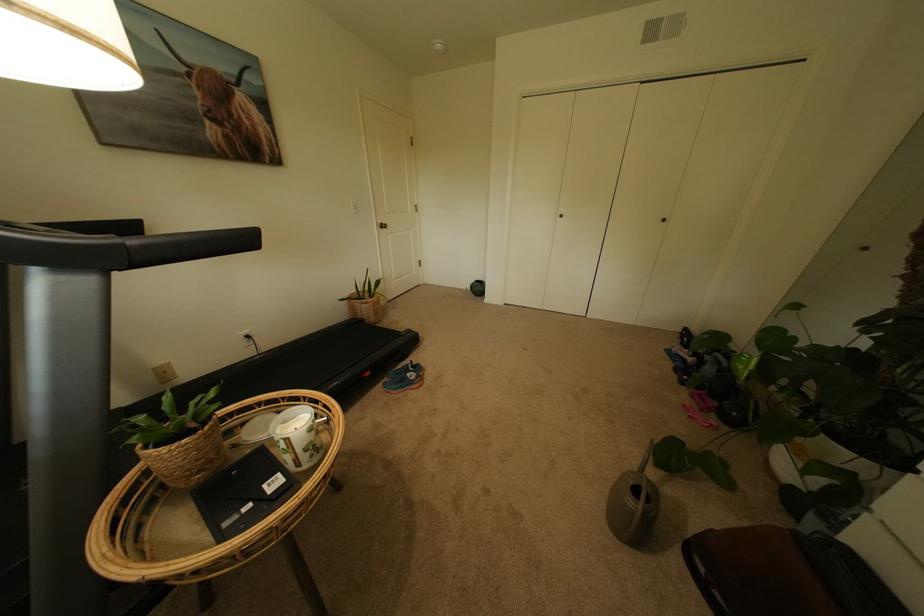
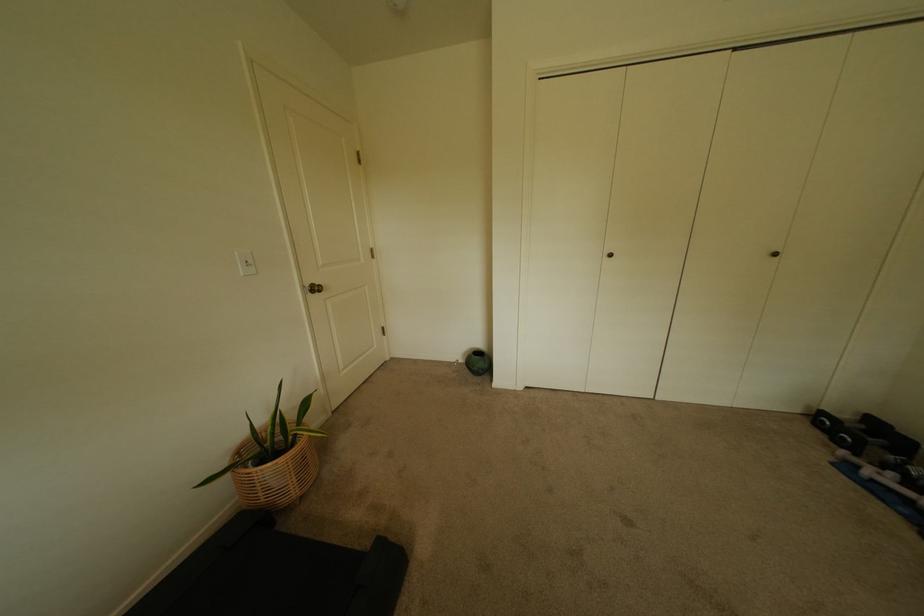
Find the pixel in the second image that matches (359,203) in the first image.

(245, 254)